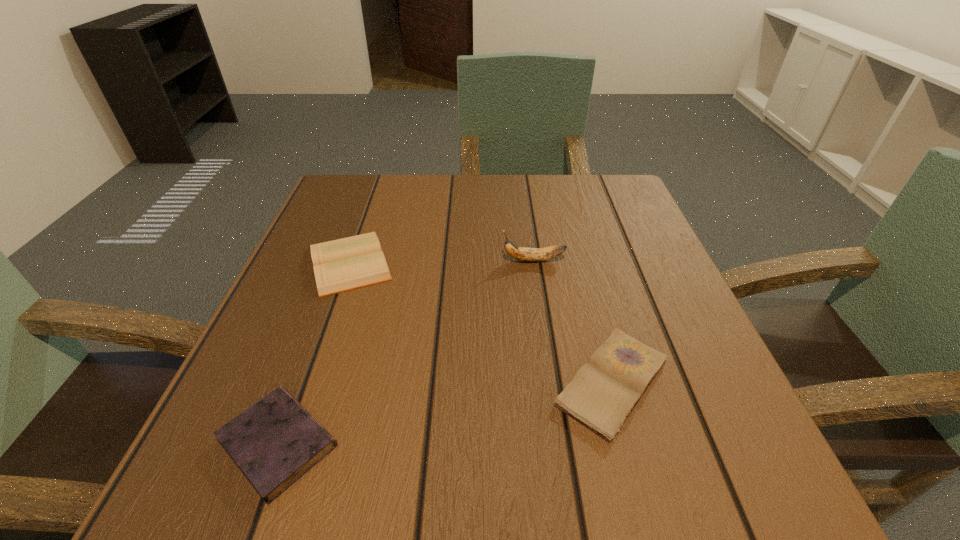
At what (x,y) coordinates should I click in order to perform the action: click on object at the near right corner. Please return your answer as a coordinate pair (x, y). The height and width of the screenshot is (540, 960). Looking at the image, I should click on (604, 391).

Locate an element on the screen. The height and width of the screenshot is (540, 960). vacant space at the far edge is located at coordinates (547, 190).

The image size is (960, 540). In order to click on vacant space at the left edge in this screenshot , I will do `click(363, 303)`.

Locate an element on the screen. The image size is (960, 540). vacant space at the right edge of the desktop is located at coordinates (647, 242).

Locate an element on the screen. free space at the far left corner is located at coordinates (322, 228).

The image size is (960, 540). I want to click on free space at the near left corner of the desktop, so click(x=201, y=470).

You are a GUI agent. You are given a task and a screenshot of the screen. Output one action in this format:
    pyautogui.click(x=<x>, y=<y>)
    Task: Click on the vacant region at the far right corner of the desktop
    The width and height of the screenshot is (960, 540).
    Given the screenshot: What is the action you would take?
    pyautogui.click(x=589, y=209)

You are a GUI agent. You are given a task and a screenshot of the screen. Output one action in this format:
    pyautogui.click(x=<x>, y=<y>)
    Task: Click on the free space between the farthest diary and the rightmost diary
    The height and width of the screenshot is (540, 960).
    Given the screenshot: What is the action you would take?
    pyautogui.click(x=481, y=322)

Locate an element on the screen. vacant space in between the tallest object and the rightmost diary is located at coordinates (573, 321).

Locate an element on the screen. vacant point located between the rightmost diary and the tallest object is located at coordinates (573, 321).